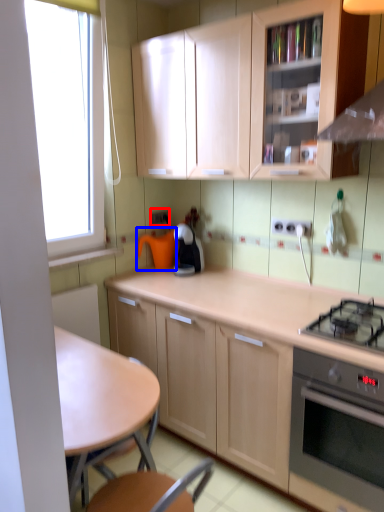
Question: Which point is further to the camera, electric outlet (highlighted by a red box) or appliance (highlighted by a blue box)?

Choices:
 (A) electric outlet
 (B) appliance

Answer: (A)